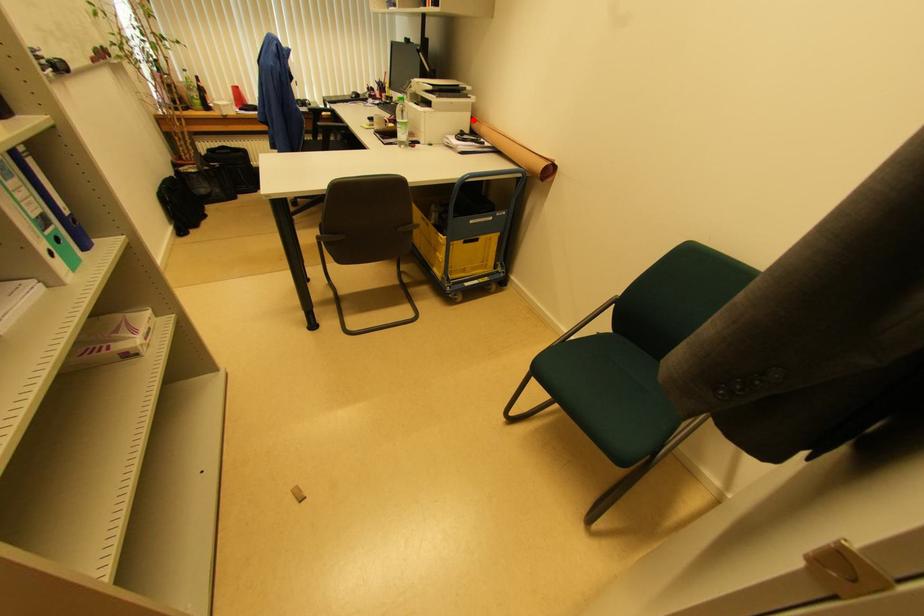
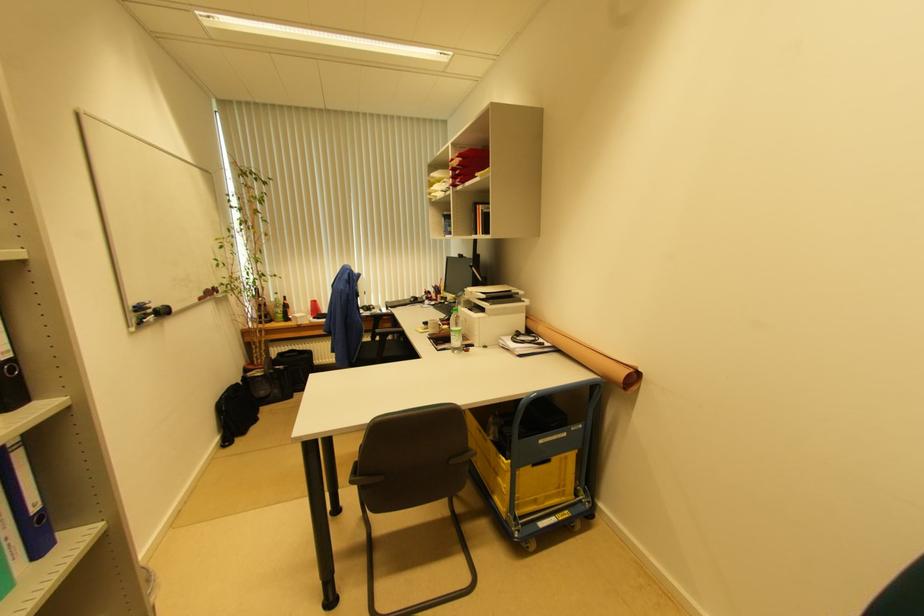
Where in the second image is the point corresponding to the highlighted location from the first image?

(528, 320)